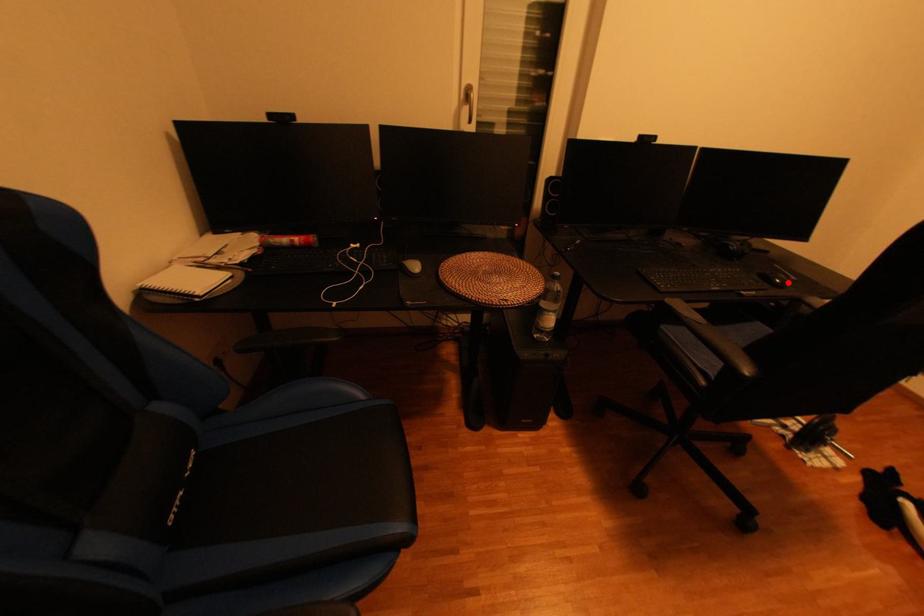
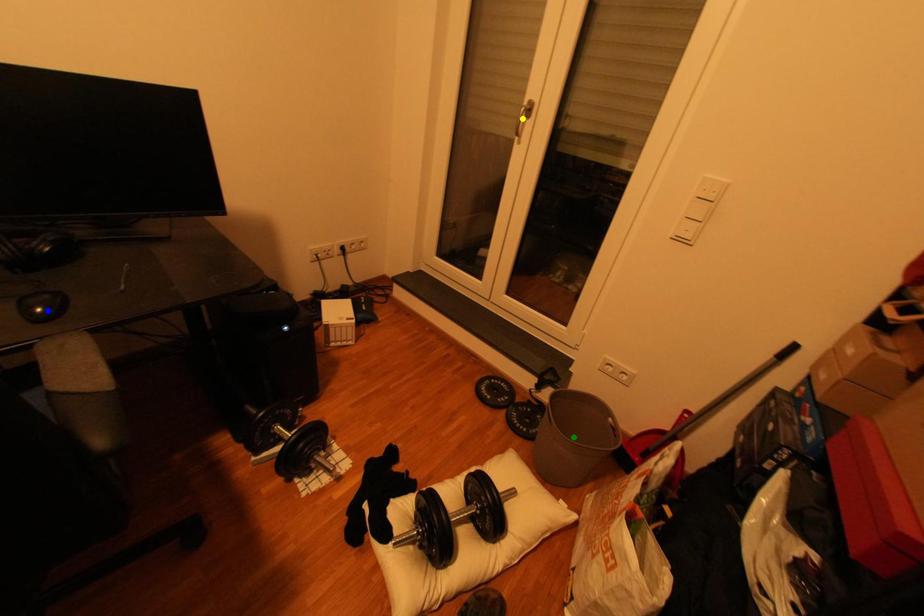
Question: I am providing you with two images of the same scene from different viewpoints. A red point is marked on the first image. You are given multiple points on the second image. In image 2, which mark is for the same physical point as the one in image 1?

Choices:
 (A) yellow point
 (B) blue point
 (C) green point

Answer: (B)